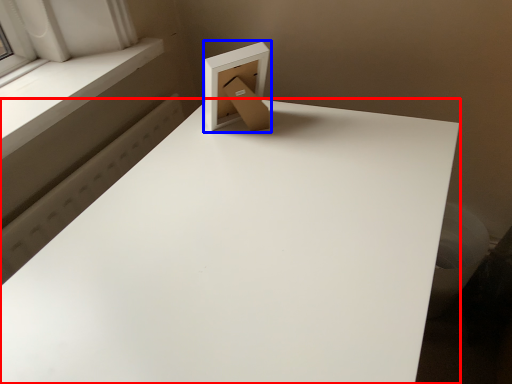
Question: Which point is further to the camera, table (highlighted by a red box) or cardboard box (highlighted by a blue box)?

Choices:
 (A) table
 (B) cardboard box

Answer: (B)